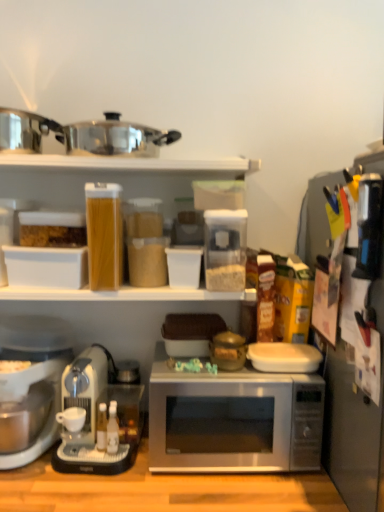
Question: Is point (367, 271) positioned closer to the camera than point (59, 417)?

Choices:
 (A) farther
 (B) closer

Answer: (B)

Question: From a real-world perspective, is black plastic knife block at right, marked as the 2th appliance in a right-to-left arrangement, positioned above or below white matte coffee cup at lower left?

Choices:
 (A) above
 (B) below

Answer: (A)

Question: Based on their relative distances, which object is nearer to the silver metallic microwave at center?

Choices:
 (A) shiny metallic pot at upper center
 (B) black plastic knife block at right, marked as the first appliance in a right-to-left arrangement
 (C) matte brown pot at center, placed as the first appliance when sorted from left to right
 (D) white matte coffee cup at lower left
 (E) white plastic coffee maker at lower left, the second coffee maker from the right

Answer: (C)

Question: Which is nearer to the black plastic knife block at right, marked as the 3th appliance in a left-to-right arrangement?

Choices:
 (A) sleek silver coffee maker at lower left, the second coffee maker positioned from the left
 (B) black plastic knife block at right, marked as the 2th appliance in a right-to-left arrangement
 (C) white plastic coffee maker at lower left, the second coffee maker from the right
 (D) matte brown pot at center, which is counted as the 3th appliance, starting from the right
 (E) shiny metallic pot at upper center

Answer: (B)